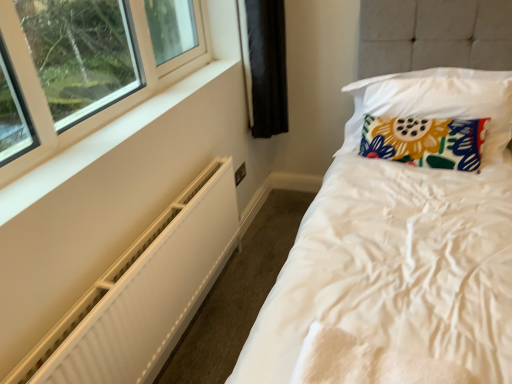
Question: Is white textured radiator at lower left further to the viewer compared to floral fabric pillow at upper right, the 2th pillow positioned from the top?

Choices:
 (A) yes
 (B) no

Answer: (B)

Question: Considering the relative sizes of white textured radiator at lower left and floral fabric pillow at upper right, the 2th pillow positioned from the top, in the image provided, is white textured radiator at lower left bigger than floral fabric pillow at upper right, the 2th pillow positioned from the top,?

Choices:
 (A) no
 (B) yes

Answer: (B)

Question: Does white textured radiator at lower left have a lesser width compared to floral fabric pillow at upper right, the 2th pillow positioned from the top?

Choices:
 (A) no
 (B) yes

Answer: (B)

Question: Can you confirm if white textured radiator at lower left is shorter than floral fabric pillow at upper right, the 2th pillow positioned from the top?

Choices:
 (A) no
 (B) yes

Answer: (A)

Question: Does white textured radiator at lower left appear on the left side of floral fabric pillow at upper right, arranged as the first pillow when ordered from the bottom?

Choices:
 (A) no
 (B) yes

Answer: (B)

Question: Does white textured radiator at lower left have a greater height compared to floral fabric pillow at upper right, the 2th pillow positioned from the top?

Choices:
 (A) yes
 (B) no

Answer: (A)

Question: Is floral fabric pillow at upper right, the 2th pillow positioned from the top, beside white textured radiator at lower left?

Choices:
 (A) no
 (B) yes

Answer: (A)

Question: Is floral fabric pillow at upper right, arranged as the first pillow when ordered from the bottom, smaller than white textured radiator at lower left?

Choices:
 (A) yes
 (B) no

Answer: (A)

Question: From the image's perspective, is floral fabric pillow at upper right, arranged as the first pillow when ordered from the bottom, below white textured radiator at lower left?

Choices:
 (A) yes
 (B) no

Answer: (B)

Question: Is floral fabric pillow at upper right, the 2th pillow positioned from the top, far from white textured radiator at lower left?

Choices:
 (A) yes
 (B) no

Answer: (A)

Question: Does floral fabric pillow at upper right, arranged as the first pillow when ordered from the bottom, have a greater width compared to white textured radiator at lower left?

Choices:
 (A) yes
 (B) no

Answer: (A)

Question: Is floral fabric pillow at upper right, arranged as the first pillow when ordered from the bottom, facing away from white textured radiator at lower left?

Choices:
 (A) no
 (B) yes

Answer: (A)

Question: Considering the relative sizes of floral fabric pillow at upper right, which ranks as the second pillow in bottom-to-top order, and white textured radiator at lower left in the image provided, is floral fabric pillow at upper right, which ranks as the second pillow in bottom-to-top order, smaller than white textured radiator at lower left?

Choices:
 (A) yes
 (B) no

Answer: (B)